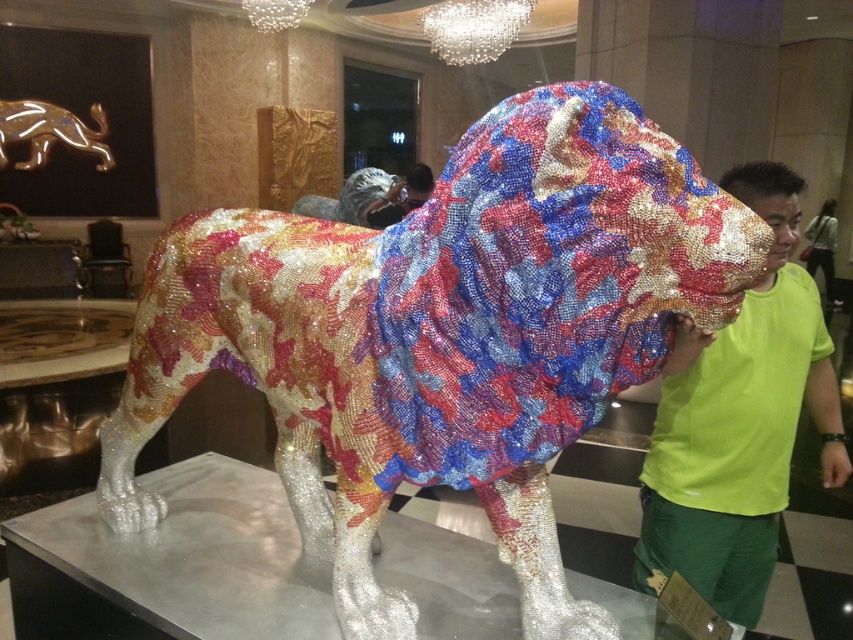
You are an interior designer planning to place a new decorative item in the space. You see the green matte shirt at right and the gold metallic lion at upper left. Which object is closer to the floor?

The green matte shirt at right is positioned under the gold metallic lion at upper left, so it is closer to the floor.

You are an interior designer planning to place a new decorative item in the space. You have a choice between placing it either in front of or behind the shiny metallic lion at center and the green matte shirt at right. Based on the current arrangement, which object should you place the new item in front of to ensure it is visible?

You should place the new item in front of the green matte shirt at right because the shiny metallic lion at center is already in front of it, so placing the new item in front of the shirt would keep it visible without being blocked by the lion.